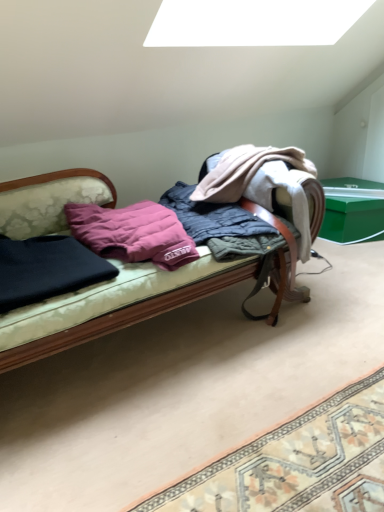
What are the coordinates of `free space underneath velvet-like fabric couch at center (from a real-world perspective)` in the screenshot? It's located at (137, 345).